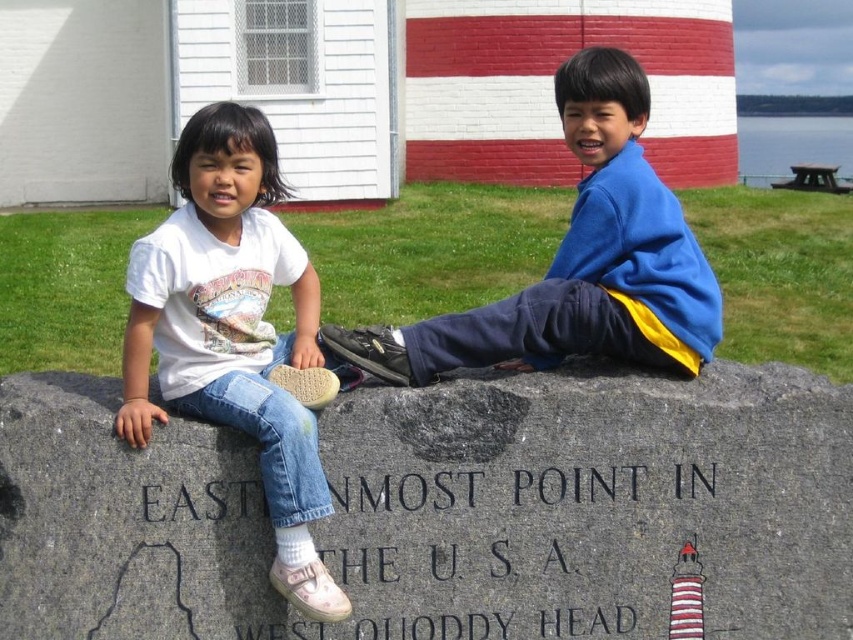
Question: Which object is closer to the camera taking this photo?

Choices:
 (A) blue fleece jacket at center
 (B) black granite stone at lower center
 (C) white cotton shirt at left

Answer: (C)

Question: Can you confirm if gray granite stone at center is positioned above black granite stone at lower center?

Choices:
 (A) yes
 (B) no

Answer: (B)

Question: Which point appears closest to the camera in this image?

Choices:
 (A) (183, 154)
 (B) (704, 260)
 (C) (138, 512)
 (D) (585, 467)

Answer: (C)

Question: In this image, where is white cotton shirt at left located relative to blue fleece jacket at center?

Choices:
 (A) right
 (B) left

Answer: (B)

Question: Which of the following is the closest to the observer?

Choices:
 (A) (140, 364)
 (B) (419, 508)
 (C) (340, 326)

Answer: (A)

Question: Can you confirm if white cotton shirt at left is bigger than black granite stone at lower center?

Choices:
 (A) yes
 (B) no

Answer: (A)